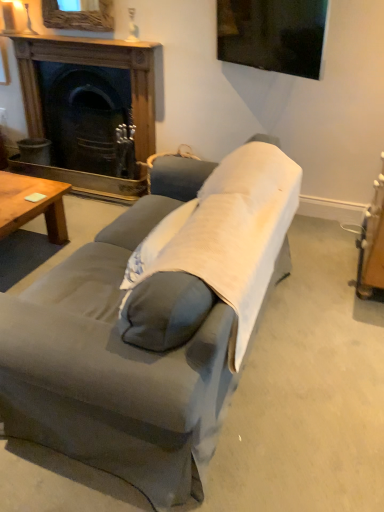
Question: Can you confirm if gray fabric couch at center is smaller than light gray fabric pillow at center?

Choices:
 (A) no
 (B) yes

Answer: (A)

Question: Is gray fabric couch at center at the right side of light gray fabric pillow at center?

Choices:
 (A) no
 (B) yes

Answer: (A)

Question: Are gray fabric couch at center and light gray fabric pillow at center making contact?

Choices:
 (A) no
 (B) yes

Answer: (A)

Question: Is gray fabric couch at center further to the viewer compared to light gray fabric pillow at center?

Choices:
 (A) no
 (B) yes

Answer: (A)

Question: From a real-world perspective, is gray fabric couch at center on light gray fabric pillow at center?

Choices:
 (A) no
 (B) yes

Answer: (A)

Question: From a real-world perspective, is gray fabric couch at center positioned under light gray fabric pillow at center based on gravity?

Choices:
 (A) no
 (B) yes

Answer: (B)

Question: Does gray fabric couch at center turn towards wooden coffee table at lower left?

Choices:
 (A) yes
 (B) no

Answer: (B)

Question: Is wooden coffee table at lower left surrounded by gray fabric couch at center?

Choices:
 (A) no
 (B) yes

Answer: (A)

Question: Is gray fabric couch at center smaller than wooden coffee table at lower left?

Choices:
 (A) yes
 (B) no

Answer: (B)

Question: Are gray fabric couch at center and wooden coffee table at lower left far apart?

Choices:
 (A) no
 (B) yes

Answer: (B)

Question: Is gray fabric couch at center thinner than wooden coffee table at lower left?

Choices:
 (A) yes
 (B) no

Answer: (B)

Question: Is gray fabric couch at center touching wooden coffee table at lower left?

Choices:
 (A) no
 (B) yes

Answer: (A)

Question: Can you confirm if light gray fabric pillow at center is positioned to the right of wooden coffee table at lower left?

Choices:
 (A) no
 (B) yes

Answer: (B)